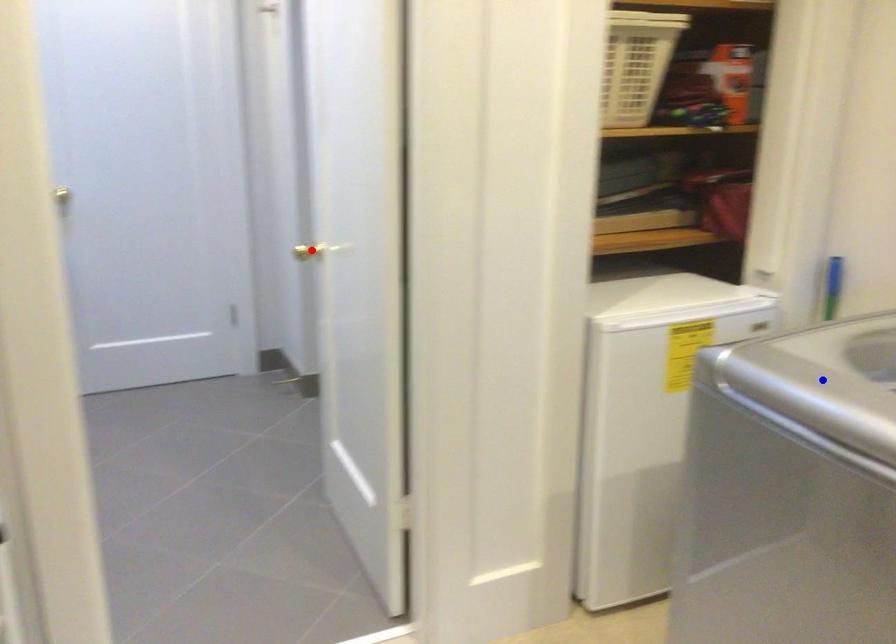
Question: Which of the two points in the image is closer to the camera?

Choices:
 (A) Blue point is closer.
 (B) Red point is closer.

Answer: (A)